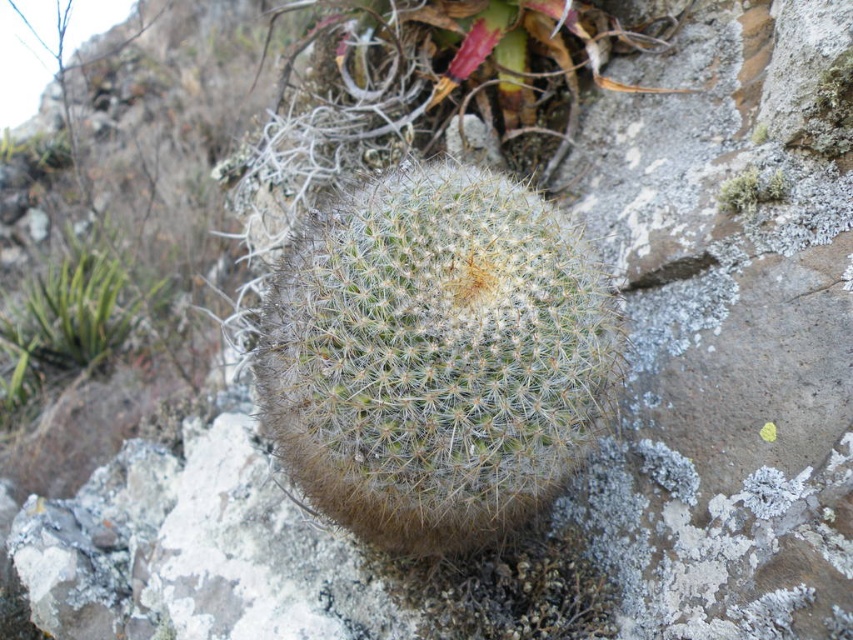
Based on the photo, based on the scene description, where is the white spiny cactus at center located in terms of its 2D coordinates?

The white spiny cactus at center is located at the 2D coordinates of point (x=434, y=356).

You are a botanist examining the image. You need to determine which object occupies more space in the frame. Based on the scene, which is larger between the green spiky cactus at left and the white fuzzy lichen at upper right?

The green spiky cactus at left is bigger than the white fuzzy lichen at upper right, so it occupies more space in the frame.